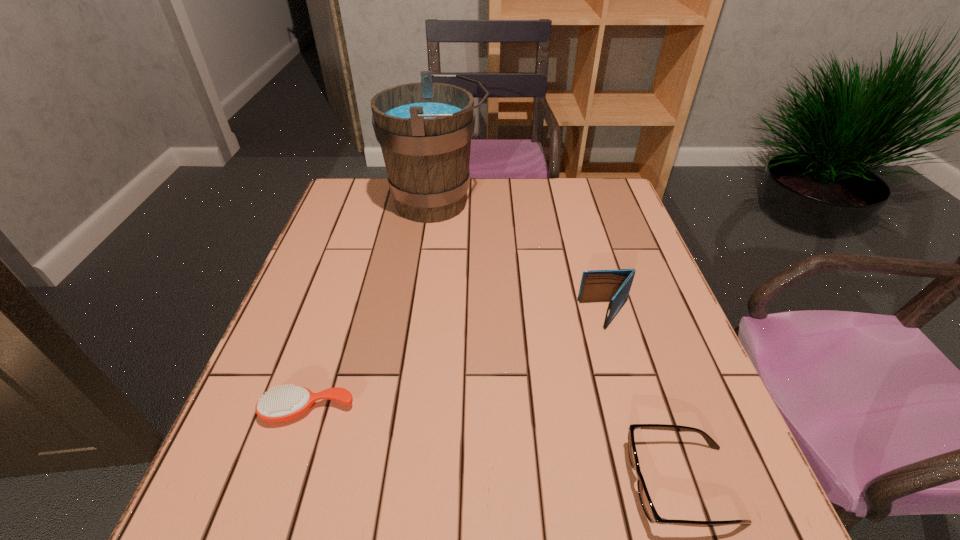
Where is `free space located on the exterior surface of the second tallest object`? This screenshot has height=540, width=960. free space located on the exterior surface of the second tallest object is located at coordinates (559, 315).

Find the location of a particular element. The height and width of the screenshot is (540, 960). vacant region located on the exterior surface of the second tallest object is located at coordinates (480, 315).

The height and width of the screenshot is (540, 960). Find the location of `vacant space located 0.230m on the lenses of the spectacles`. vacant space located 0.230m on the lenses of the spectacles is located at coordinates pyautogui.click(x=490, y=484).

Locate an element on the screen. free location located on the lenses of the spectacles is located at coordinates (490, 484).

Where is `vacant space located 0.310m on the lenses of the spectacles`? vacant space located 0.310m on the lenses of the spectacles is located at coordinates (441, 484).

Image resolution: width=960 pixels, height=540 pixels. I want to click on free point located 0.050m on the right of the shortest object, so click(x=380, y=410).

At what (x,y) coordinates should I click in order to perform the action: click on object situated at the far edge. Please return your answer as a coordinate pair (x, y). This screenshot has height=540, width=960. Looking at the image, I should click on (424, 129).

The image size is (960, 540). What are the coordinates of `object located at the near edge` in the screenshot? It's located at (646, 502).

Identify the location of wine bucket positioned at the left edge. (424, 129).

Find the location of `hairbrush positioned at the left edge`. hairbrush positioned at the left edge is located at coordinates point(280,404).